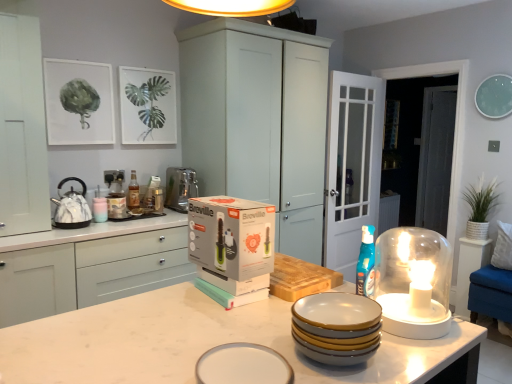
Question: From the image's perspective, is clear glass door at center, arranged as the second glass door when viewed from the back, positioned above or below white glossy table at right?

Choices:
 (A) above
 (B) below

Answer: (A)

Question: Based on their sizes in the image, would you say clear glass door at center, arranged as the second glass door when viewed from the back, is bigger or smaller than white glossy table at right?

Choices:
 (A) small
 (B) big

Answer: (B)

Question: Based on their relative distances, which object is farther from the white matte cabinet at left, the second cabinetry when ordered from left to right?

Choices:
 (A) white glossy table at right
 (B) marble/textured kettle at left
 (C) white matte cabinet at left, the 1th cabinetry from the left
 (D) transparent glass door at right, marked as the 1th glass door in a right-to-left arrangement
 (E) white matte cabinet at center, acting as the 3th cabinetry starting from the left

Answer: (D)

Question: Which of these objects is positioned farthest from the marble/textured kettle at left?

Choices:
 (A) matte glass bottle at upper left
 (B) white fabric pillow at right
 (C) green leafy plant at upper left, the second plant positioned from the bottom
 (D) clear glass door at center, arranged as the second glass door when viewed from the back
 (E) satin silver appliance at left

Answer: (B)